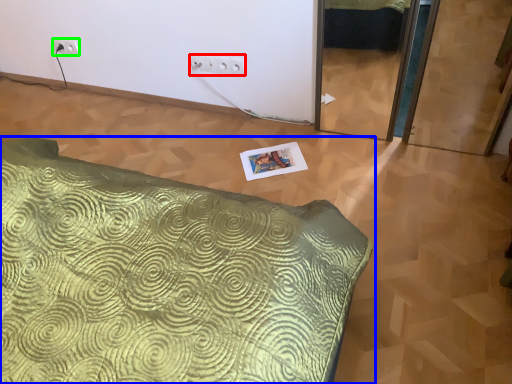
Question: Which object is positioned closest to electric outlet (highlighted by a red box)? Select from bed (highlighted by a blue box) and electric outlet (highlighted by a green box).

Choices:
 (A) bed
 (B) electric outlet

Answer: (B)